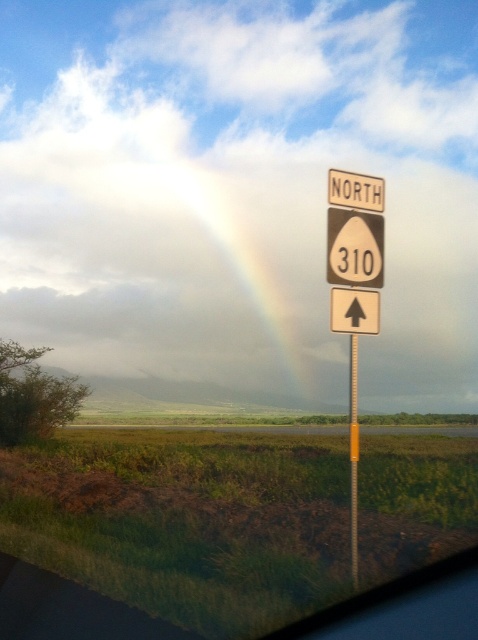
You are a driver who needs to read both the brown paper speed limit sign at upper right and the white plastic arrow at center while driving. Which object might you need to look at for a longer time because it is wider?

The brown paper speed limit sign at upper right might be wider than the white plastic arrow at center, so you might need to look at the brown paper speed limit sign at upper right for a longer time to read it properly.

You are driving a car and see the brown paper speed limit sign at upper right and the white plastic arrow at center. Which object is nearer to you?

The brown paper speed limit sign at upper right is closer to the viewer than the white plastic arrow at center.